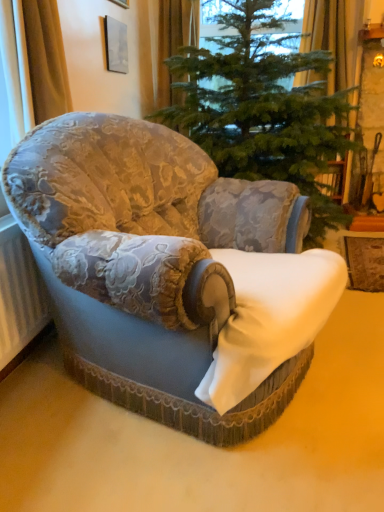
Locate an element on the screen. This screenshot has height=512, width=384. green textured christmas tree at center is located at coordinates tap(267, 103).

Image resolution: width=384 pixels, height=512 pixels. What are the coordinates of `gold textured curtain at left, the 1th curtain in the left-to-right sequence` in the screenshot? It's located at (46, 60).

Measure the distance between gold textured curtain at left, the 1th curtain in the left-to-right sequence, and camera.

gold textured curtain at left, the 1th curtain in the left-to-right sequence, is 4.90 feet from camera.

At what (x,y) coordinates should I click in order to perform the action: click on orange fabric curtain at upper center, the second curtain from the right. Please return your answer as a coordinate pair (x, y). Image resolution: width=384 pixels, height=512 pixels. Looking at the image, I should click on (173, 45).

Is green textured christmas tree at center thinner than yellow fabric curtain at upper right, the 3th curtain from the left?

No, green textured christmas tree at center is not thinner than yellow fabric curtain at upper right, the 3th curtain from the left.

From the image's perspective, is green textured christmas tree at center under yellow fabric curtain at upper right, arranged as the 2th curtain when viewed from the back?

Yes, from the image's perspective, green textured christmas tree at center is beneath yellow fabric curtain at upper right, arranged as the 2th curtain when viewed from the back.

Is green textured christmas tree at center placed right next to yellow fabric curtain at upper right, which ranks as the 1th curtain in right-to-left order?

green textured christmas tree at center and yellow fabric curtain at upper right, which ranks as the 1th curtain in right-to-left order, are clearly separated.

How many degrees apart are the facing directions of green textured christmas tree at center and yellow fabric curtain at upper right, the 2th curtain from the front?

0.00334 degrees.

Looking at this image, which object is thinner, velvet floral armchair at center or yellow fabric curtain at upper right, the 2th curtain from the front?

yellow fabric curtain at upper right, the 2th curtain from the front, is thinner.

Can you see velvet floral armchair at center touching yellow fabric curtain at upper right, the 3th curtain from the left?

No, velvet floral armchair at center is not beside yellow fabric curtain at upper right, the 3th curtain from the left.

From their relative heights in the image, would you say velvet floral armchair at center is taller or shorter than yellow fabric curtain at upper right, arranged as the 2th curtain when viewed from the back?

Considering their sizes, velvet floral armchair at center has more height than yellow fabric curtain at upper right, arranged as the 2th curtain when viewed from the back.

Considering the relative sizes of velvet floral armchair at center and yellow fabric curtain at upper right, the 2th curtain from the front, in the image provided, is velvet floral armchair at center smaller than yellow fabric curtain at upper right, the 2th curtain from the front,?

Actually, velvet floral armchair at center might be larger than yellow fabric curtain at upper right, the 2th curtain from the front.

Is white textured radiator at lower left outside of orange fabric curtain at upper center, positioned as the second curtain in left-to-right order?

That's correct, white textured radiator at lower left is outside of orange fabric curtain at upper center, positioned as the second curtain in left-to-right order.

Identify the location of radiator on the left of orange fabric curtain at upper center, the second curtain from the right. (18, 293).

How many degrees apart are the facing directions of white textured radiator at lower left and orange fabric curtain at upper center, the first curtain positioned from the back?

85.7 degrees separate the facing orientations of white textured radiator at lower left and orange fabric curtain at upper center, the first curtain positioned from the back.

In terms of height, does white textured radiator at lower left look taller or shorter compared to orange fabric curtain at upper center, the first curtain positioned from the back?

In the image, white textured radiator at lower left appears to be shorter than orange fabric curtain at upper center, the first curtain positioned from the back.

Does orange fabric curtain at upper center, positioned as the second curtain in left-to-right order, have a lesser height compared to green textured christmas tree at center?

Correct, orange fabric curtain at upper center, positioned as the second curtain in left-to-right order, is not as tall as green textured christmas tree at center.

From a real-world perspective, between orange fabric curtain at upper center, the second curtain from the right, and green textured christmas tree at center, who is vertically higher?

orange fabric curtain at upper center, the second curtain from the right, is physically above.

From the picture: Is orange fabric curtain at upper center, the first curtain positioned from the back, facing towards green textured christmas tree at center?

Yes, orange fabric curtain at upper center, the first curtain positioned from the back, is aimed at green textured christmas tree at center.

Which object is wider, orange fabric curtain at upper center, positioned as the second curtain in left-to-right order, or green textured christmas tree at center?

Wider between the two is green textured christmas tree at center.

The height and width of the screenshot is (512, 384). In order to click on curtain that is the 2nd one above the velvet floral armchair at center (from a real-world perspective) in this screenshot , I will do [x=335, y=38].

From the image's perspective, relative to velvet floral armchair at center, is yellow fabric curtain at upper right, the 2th curtain from the front, above or below?

Clearly, from the image's perspective, yellow fabric curtain at upper right, the 2th curtain from the front, is above velvet floral armchair at center.

Which of these two, yellow fabric curtain at upper right, arranged as the 2th curtain when viewed from the back, or velvet floral armchair at center, stands taller?

Standing taller between the two is velvet floral armchair at center.

Does yellow fabric curtain at upper right, the 3th curtain from the left, have a lesser width compared to velvet floral armchair at center?

Yes.

Between green textured christmas tree at center and orange fabric curtain at upper center, the second curtain from the right, which one has smaller size?

orange fabric curtain at upper center, the second curtain from the right, is smaller.

How different are the orientations of green textured christmas tree at center and orange fabric curtain at upper center, placed as the 3th curtain when sorted from front to back, in degrees?

0.00209 degrees separate the facing orientations of green textured christmas tree at center and orange fabric curtain at upper center, placed as the 3th curtain when sorted from front to back.

From a real-world perspective, is green textured christmas tree at center below orange fabric curtain at upper center, positioned as the second curtain in left-to-right order?

Indeed, from a real-world perspective, green textured christmas tree at center is positioned beneath orange fabric curtain at upper center, positioned as the second curtain in left-to-right order.

This screenshot has width=384, height=512. In the image, there is a orange fabric curtain at upper center, the second curtain from the right. Find the location of `christmas tree below it (from a real-world perspective)`. christmas tree below it (from a real-world perspective) is located at coordinates (267, 103).

Relative to gold textured curtain at left, the 1th curtain in the left-to-right sequence, is yellow fabric curtain at upper right, the 3th curtain from the left, in front or behind?

Clearly, yellow fabric curtain at upper right, the 3th curtain from the left, is behind gold textured curtain at left, the 1th curtain in the left-to-right sequence.

Could you measure the distance between yellow fabric curtain at upper right, arranged as the 2th curtain when viewed from the back, and gold textured curtain at left, which is counted as the third curtain, starting from the right?

yellow fabric curtain at upper right, arranged as the 2th curtain when viewed from the back, is 5.82 feet away from gold textured curtain at left, which is counted as the third curtain, starting from the right.

Is yellow fabric curtain at upper right, the 2th curtain from the front, to the left or to the right of gold textured curtain at left, the 1th curtain in the left-to-right sequence, in the image?

Based on their positions, yellow fabric curtain at upper right, the 2th curtain from the front, is located to the right of gold textured curtain at left, the 1th curtain in the left-to-right sequence.

Can gold textured curtain at left, which is counted as the third curtain, starting from the right, be found inside yellow fabric curtain at upper right, the 2th curtain from the front?

Definitely not — gold textured curtain at left, which is counted as the third curtain, starting from the right, is not inside yellow fabric curtain at upper right, the 2th curtain from the front.

Image resolution: width=384 pixels, height=512 pixels. Find the location of `christmas tree that appears below the yellow fabric curtain at upper right, the 2th curtain from the front (from the image's perspective)`. christmas tree that appears below the yellow fabric curtain at upper right, the 2th curtain from the front (from the image's perspective) is located at coordinates (267, 103).

From the velvet floral armchair at center, count 2nd curtains backward and point to it. Please provide its 2D coordinates.

[(335, 38)]

Which object lies nearer to the anchor point white textured radiator at lower left, velvet floral armchair at center or gold textured curtain at left, arranged as the 1th curtain when viewed from the front?

The object closer to white textured radiator at lower left is velvet floral armchair at center.

When comparing their distances from white textured radiator at lower left, does orange fabric curtain at upper center, placed as the 3th curtain when sorted from front to back, or green textured christmas tree at center seem further?

Among the two, orange fabric curtain at upper center, placed as the 3th curtain when sorted from front to back, is located further to white textured radiator at lower left.

Which object lies further to the anchor point gold textured curtain at left, the 1th curtain in the left-to-right sequence, white textured radiator at lower left or yellow fabric curtain at upper right, which ranks as the 1th curtain in right-to-left order?

yellow fabric curtain at upper right, which ranks as the 1th curtain in right-to-left order, is positioned further to the anchor gold textured curtain at left, the 1th curtain in the left-to-right sequence.

Looking at the image, which one is located closer to orange fabric curtain at upper center, the first curtain positioned from the back, white textured radiator at lower left or green textured christmas tree at center?

green textured christmas tree at center is positioned closer to the anchor orange fabric curtain at upper center, the first curtain positioned from the back.

From the image, which object appears to be nearer to white textured radiator at lower left, gold textured curtain at left, the third curtain from the back, or orange fabric curtain at upper center, the first curtain positioned from the back?

Based on the image, gold textured curtain at left, the third curtain from the back, appears to be nearer to white textured radiator at lower left.

Which object lies nearer to the anchor point green textured christmas tree at center, yellow fabric curtain at upper right, the 3th curtain from the left, or orange fabric curtain at upper center, the first curtain positioned from the back?

yellow fabric curtain at upper right, the 3th curtain from the left, is positioned closer to the anchor green textured christmas tree at center.

Estimate the real-world distances between objects in this image. Which object is closer to white textured radiator at lower left, velvet floral armchair at center or yellow fabric curtain at upper right, which ranks as the 1th curtain in right-to-left order?

velvet floral armchair at center is closer to white textured radiator at lower left.

Considering their positions, is gold textured curtain at left, which is counted as the third curtain, starting from the right, positioned further to orange fabric curtain at upper center, placed as the 3th curtain when sorted from front to back, than yellow fabric curtain at upper right, which ranks as the 1th curtain in right-to-left order?

gold textured curtain at left, which is counted as the third curtain, starting from the right, lies further to orange fabric curtain at upper center, placed as the 3th curtain when sorted from front to back, than the other object.

Locate an element on the screen. The height and width of the screenshot is (512, 384). christmas tree positioned between gold textured curtain at left, the 1th curtain in the left-to-right sequence, and orange fabric curtain at upper center, the first curtain positioned from the back, from near to far is located at coordinates (267, 103).

At what (x,y) coordinates should I click in order to perform the action: click on christmas tree between white textured radiator at lower left and yellow fabric curtain at upper right, which ranks as the 1th curtain in right-to-left order, in the front-back direction. Please return your answer as a coordinate pair (x, y). This screenshot has height=512, width=384. Looking at the image, I should click on (267, 103).

Identify the location of christmas tree located between velvet floral armchair at center and yellow fabric curtain at upper right, the 3th curtain from the left, in the depth direction. coord(267,103).

You are a GUI agent. You are given a task and a screenshot of the screen. Output one action in this format:
    pyautogui.click(x=<x>, y=<y>)
    Task: Click on the radiator between velvet floral armchair at center and yellow fabric curtain at upper right, the 2th curtain from the front, from front to back
    The width and height of the screenshot is (384, 512).
    Given the screenshot: What is the action you would take?
    pyautogui.click(x=18, y=293)